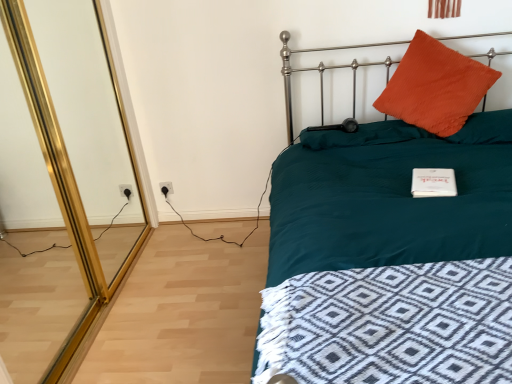
What do you see at coordinates (362, 135) in the screenshot?
I see `orange fuzzy pillow at upper right, which is the 1th pillow from left to right` at bounding box center [362, 135].

What do you see at coordinates (485, 128) in the screenshot?
I see `orange corduroy pillow at upper right, marked as the 3th pillow in a left-to-right arrangement` at bounding box center [485, 128].

At what (x,y) coordinates should I click in order to perform the action: click on teal fabric bed at upper right. Please return your answer as a coordinate pair (x, y). Looking at the image, I should click on (386, 207).

What do you see at coordinates (435, 87) in the screenshot? I see `orange corduroy pillow at upper right, arranged as the second pillow when viewed from the left` at bounding box center [435, 87].

I want to click on gold mirrored screen door at left, so click(x=59, y=183).

Considering the relative positions of gold mirrored screen door at left and orange corduroy pillow at upper right, arranged as the second pillow when viewed from the left, in the image provided, is gold mirrored screen door at left to the left or to the right of orange corduroy pillow at upper right, arranged as the second pillow when viewed from the left,?

In the image, gold mirrored screen door at left appears on the left side of orange corduroy pillow at upper right, arranged as the second pillow when viewed from the left.

Could orange corduroy pillow at upper right, arranged as the second pillow when viewed from the left, be considered to be inside gold mirrored screen door at left?

Definitely not — orange corduroy pillow at upper right, arranged as the second pillow when viewed from the left, is not inside gold mirrored screen door at left.

Is point (16, 262) farther from viewer compared to point (414, 39)?

Yes, point (16, 262) is farther from viewer.

Can you confirm if orange fuzzy pillow at upper right, acting as the 3th pillow starting from the right, is taller than white plastic electric outlet at lower left?

No.

Is orange fuzzy pillow at upper right, acting as the 3th pillow starting from the right, facing towards white plastic electric outlet at lower left?

No, orange fuzzy pillow at upper right, acting as the 3th pillow starting from the right, does not turn towards white plastic electric outlet at lower left.

Is orange fuzzy pillow at upper right, which is the 1th pillow from left to right, surrounding white plastic electric outlet at lower left?

Actually, white plastic electric outlet at lower left is outside orange fuzzy pillow at upper right, which is the 1th pillow from left to right.

Can you tell me how much orange fuzzy pillow at upper right, acting as the 3th pillow starting from the right, and white plastic electric outlet at lower left differ in facing direction?

orange fuzzy pillow at upper right, acting as the 3th pillow starting from the right, and white plastic electric outlet at lower left are facing 1.06 degrees away from each other.

Is teal fabric bed at upper right far from white plastic electric outlet at lower left?

teal fabric bed at upper right is far away from white plastic electric outlet at lower left.

From the image's perspective, which one is positioned lower, teal fabric bed at upper right or white plastic electric outlet at lower left?

From the image's view, teal fabric bed at upper right is below.

Which object is further away from the camera, teal fabric bed at upper right or white plastic electric outlet at lower left?

Positioned behind is white plastic electric outlet at lower left.

Which of these two, teal fabric bed at upper right or white plastic electric outlet at lower left, stands taller?

teal fabric bed at upper right.

Is gold mirrored screen door at left in contact with orange corduroy pillow at upper right, the 1th pillow from the right?

gold mirrored screen door at left and orange corduroy pillow at upper right, the 1th pillow from the right, are clearly separated.

Looking at their sizes, would you say gold mirrored screen door at left is wider or thinner than orange corduroy pillow at upper right, the 1th pillow from the right?

gold mirrored screen door at left is thinner than orange corduroy pillow at upper right, the 1th pillow from the right.

From a real-world perspective, is gold mirrored screen door at left positioned above or below orange corduroy pillow at upper right, the 1th pillow from the right?

gold mirrored screen door at left is situated higher than orange corduroy pillow at upper right, the 1th pillow from the right, in the real world.

Does gold mirrored screen door at left have a lesser height compared to orange corduroy pillow at upper right, marked as the 3th pillow in a left-to-right arrangement?

No, gold mirrored screen door at left is not shorter than orange corduroy pillow at upper right, marked as the 3th pillow in a left-to-right arrangement.

Who is more distant, orange corduroy pillow at upper right, arranged as the second pillow when viewed from the left, or white plastic electric outlet at lower left?

white plastic electric outlet at lower left is more distant.

Considering the sizes of objects orange corduroy pillow at upper right, arranged as the second pillow when viewed from the right, and white plastic electric outlet at lower left in the image provided, who is taller, orange corduroy pillow at upper right, arranged as the second pillow when viewed from the right, or white plastic electric outlet at lower left?

orange corduroy pillow at upper right, arranged as the second pillow when viewed from the right, is taller.

Looking at their sizes, would you say orange corduroy pillow at upper right, arranged as the second pillow when viewed from the left, is wider or thinner than white plastic electric outlet at lower left?

Clearly, orange corduroy pillow at upper right, arranged as the second pillow when viewed from the left, has more width compared to white plastic electric outlet at lower left.

Looking at their sizes, would you say orange fuzzy pillow at upper right, which is the 1th pillow from left to right, is wider or thinner than gold mirrored screen door at left?

orange fuzzy pillow at upper right, which is the 1th pillow from left to right, is wider than gold mirrored screen door at left.

Would you consider orange fuzzy pillow at upper right, which is the 1th pillow from left to right, to be distant from gold mirrored screen door at left?

Yes, orange fuzzy pillow at upper right, which is the 1th pillow from left to right, and gold mirrored screen door at left are located far from each other.

Considering the sizes of objects orange fuzzy pillow at upper right, which is the 1th pillow from left to right, and gold mirrored screen door at left in the image provided, who is taller, orange fuzzy pillow at upper right, which is the 1th pillow from left to right, or gold mirrored screen door at left?

gold mirrored screen door at left.

Measure the distance between orange fuzzy pillow at upper right, acting as the 3th pillow starting from the right, and gold mirrored screen door at left.

orange fuzzy pillow at upper right, acting as the 3th pillow starting from the right, is 5.12 feet from gold mirrored screen door at left.

Are orange corduroy pillow at upper right, arranged as the second pillow when viewed from the right, and teal fabric bed at upper right beside each other?

No, orange corduroy pillow at upper right, arranged as the second pillow when viewed from the right, is not touching teal fabric bed at upper right.

Is orange corduroy pillow at upper right, arranged as the second pillow when viewed from the right, thinner than teal fabric bed at upper right?

Yes.

Between point (462, 57) and point (394, 259), which one is positioned in front?

The point (394, 259) is more forward.

Where is `screen door located in front of the orange corduroy pillow at upper right, arranged as the second pillow when viewed from the left`? screen door located in front of the orange corduroy pillow at upper right, arranged as the second pillow when viewed from the left is located at coordinates (59, 183).

You are a GUI agent. You are given a task and a screenshot of the screen. Output one action in this format:
    pyautogui.click(x=<x>, y=<y>)
    Task: Click on the electric outlet that is below the orange fuzzy pillow at upper right, which is the 1th pillow from left to right (from the image's perspective)
    The image size is (512, 384).
    Given the screenshot: What is the action you would take?
    pyautogui.click(x=166, y=188)

From the image, which object appears to be farther from orange corduroy pillow at upper right, the 1th pillow from the right, orange fuzzy pillow at upper right, which is the 1th pillow from left to right, or teal fabric bed at upper right?

Among the two, teal fabric bed at upper right is located further to orange corduroy pillow at upper right, the 1th pillow from the right.

When comparing their distances from gold mirrored screen door at left, does orange corduroy pillow at upper right, arranged as the second pillow when viewed from the right, or teal fabric bed at upper right seem further?

orange corduroy pillow at upper right, arranged as the second pillow when viewed from the right, is further to gold mirrored screen door at left.

Based on the photo, which object lies further to the anchor point white plastic electric outlet at lower left, gold mirrored screen door at left or orange corduroy pillow at upper right, the 1th pillow from the right?

orange corduroy pillow at upper right, the 1th pillow from the right, is positioned further to the anchor white plastic electric outlet at lower left.

Consider the image. Considering their positions, is teal fabric bed at upper right positioned closer to orange corduroy pillow at upper right, arranged as the second pillow when viewed from the right, than gold mirrored screen door at left?

Among the two, teal fabric bed at upper right is located nearer to orange corduroy pillow at upper right, arranged as the second pillow when viewed from the right.

Based on their spatial positions, is orange corduroy pillow at upper right, marked as the 3th pillow in a left-to-right arrangement, or teal fabric bed at upper right further from gold mirrored screen door at left?

Among the two, orange corduroy pillow at upper right, marked as the 3th pillow in a left-to-right arrangement, is located further to gold mirrored screen door at left.

From the image, which object appears to be farther from teal fabric bed at upper right, gold mirrored screen door at left or orange corduroy pillow at upper right, arranged as the second pillow when viewed from the left?

gold mirrored screen door at left.

Considering their positions, is orange fuzzy pillow at upper right, which is the 1th pillow from left to right, positioned further to teal fabric bed at upper right than white plastic electric outlet at lower left?

white plastic electric outlet at lower left lies further to teal fabric bed at upper right than the other object.

Estimate the real-world distances between objects in this image. Which object is further from white plastic electric outlet at lower left, orange corduroy pillow at upper right, arranged as the second pillow when viewed from the left, or teal fabric bed at upper right?

orange corduroy pillow at upper right, arranged as the second pillow when viewed from the left, lies further to white plastic electric outlet at lower left than the other object.

Identify the location of screen door between teal fabric bed at upper right and orange fuzzy pillow at upper right, acting as the 3th pillow starting from the right, in the front-back direction. Image resolution: width=512 pixels, height=384 pixels. click(x=59, y=183).

Identify the location of screen door between teal fabric bed at upper right and white plastic electric outlet at lower left from front to back. (59, 183).

Locate an element on the screen. pillow between orange fuzzy pillow at upper right, which is the 1th pillow from left to right, and orange corduroy pillow at upper right, marked as the 3th pillow in a left-to-right arrangement, in the horizontal direction is located at coordinates (435, 87).

This screenshot has height=384, width=512. I want to click on electric outlet between gold mirrored screen door at left and orange corduroy pillow at upper right, arranged as the second pillow when viewed from the left, so click(166, 188).